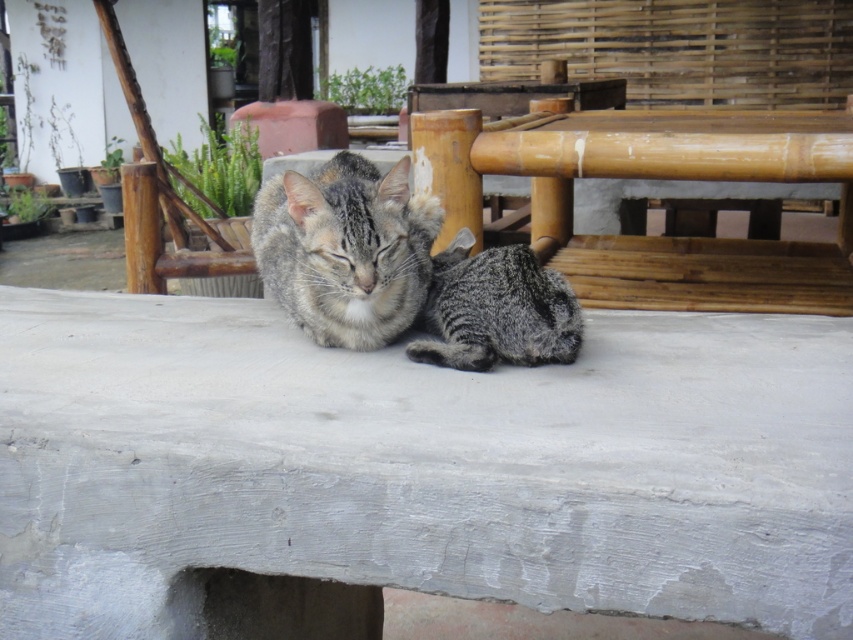
In the scene shown: Measure the distance between bamboo table at center and gray fur cat at center.

They are 1.81 meters apart.

Between bamboo table at center and gray fur cat at center, which one appears on the right side from the viewer's perspective?

bamboo table at center

Locate an element on the screen. bamboo table at center is located at coordinates (688, 179).

This screenshot has height=640, width=853. Identify the location of bamboo table at center. (688, 179).

Can you confirm if gray concrete at center is positioned below bamboo table at center?

Yes.

Does point (122, 552) come behind point (816, 305)?

No, (122, 552) is closer to viewer.

Locate an element on the screen. The width and height of the screenshot is (853, 640). gray concrete at center is located at coordinates (416, 467).

Is gray striped fur cat at center closer to the viewer compared to gray fur cat at center?

Yes, gray striped fur cat at center is in front of gray fur cat at center.

Can you confirm if gray striped fur cat at center is positioned above gray fur cat at center?

Yes, gray striped fur cat at center is above gray fur cat at center.

At what (x,y) coordinates should I click in order to perform the action: click on gray striped fur cat at center. Please return your answer as a coordinate pair (x, y). This screenshot has width=853, height=640. Looking at the image, I should click on tap(345, 250).